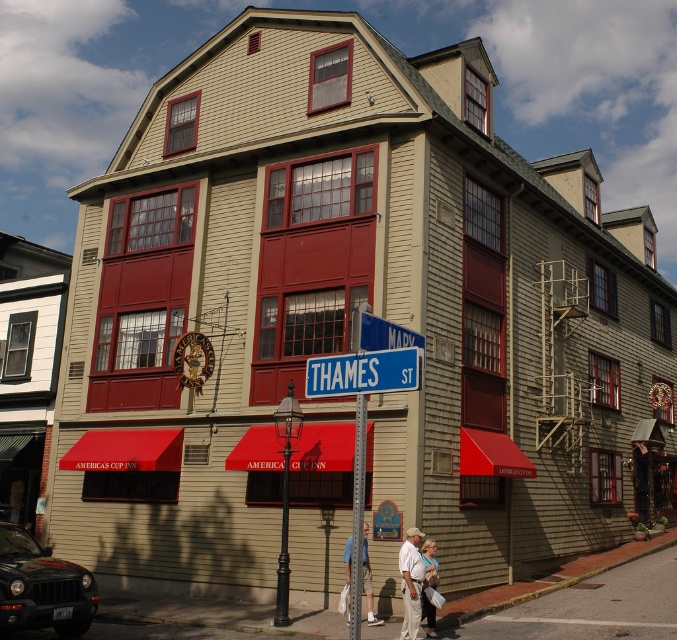
Between black matte car at lower left and blue plastic street sign at upper center, which one has less height?

Standing shorter between the two is blue plastic street sign at upper center.

Is the position of black matte car at lower left more distant than that of blue plastic street sign at upper center?

Yes.

Describe the element at coordinates (41, 588) in the screenshot. I see `black matte car at lower left` at that location.

This screenshot has width=677, height=640. Find the location of `black matte car at lower left`. black matte car at lower left is located at coordinates (41, 588).

Does black matte car at lower left appear over brushed metal pole at center?

Actually, black matte car at lower left is below brushed metal pole at center.

Image resolution: width=677 pixels, height=640 pixels. In order to click on black matte car at lower left in this screenshot , I will do `click(41, 588)`.

Which is above, blue metal street sign at center or blue plastic street sign at upper center?

blue plastic street sign at upper center is higher up.

Can you confirm if blue metal street sign at center is bigger than blue plastic street sign at upper center?

Indeed, blue metal street sign at center has a larger size compared to blue plastic street sign at upper center.

Is point (372, 356) positioned in front of point (374, 317)?

That is True.

This screenshot has width=677, height=640. Find the location of `blue metal street sign at center`. blue metal street sign at center is located at coordinates (364, 372).